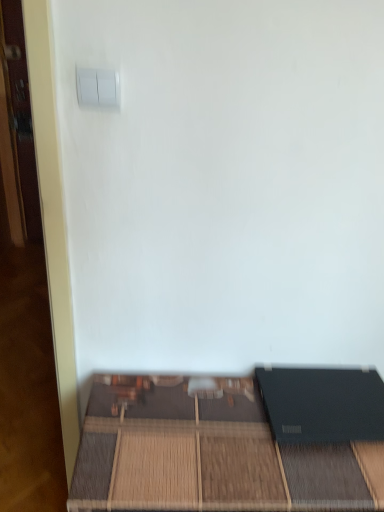
Question: Based on their sizes in the image, would you say matte black laptop at lower right is bigger or smaller than white plastic light switch at upper left?

Choices:
 (A) small
 (B) big

Answer: (B)

Question: From a real-world perspective, is matte black laptop at lower right above or below white plastic light switch at upper left?

Choices:
 (A) above
 (B) below

Answer: (B)

Question: Is matte black laptop at lower right taller or shorter than white plastic light switch at upper left?

Choices:
 (A) tall
 (B) short

Answer: (A)

Question: Choose the correct answer: Is white plastic light switch at upper left inside matte black laptop at lower right or outside it?

Choices:
 (A) inside
 (B) outside

Answer: (B)

Question: From a real-world perspective, is white plastic light switch at upper left positioned above or below matte black laptop at lower right?

Choices:
 (A) below
 (B) above

Answer: (B)

Question: From the image's perspective, is white plastic light switch at upper left above or below matte black laptop at lower right?

Choices:
 (A) above
 (B) below

Answer: (A)

Question: Does point (109, 75) appear closer or farther from the camera than point (86, 501)?

Choices:
 (A) closer
 (B) farther

Answer: (A)